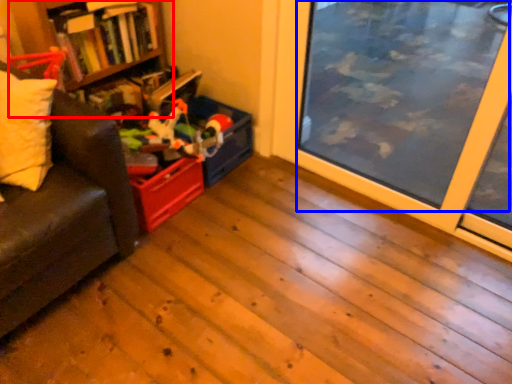
Question: Which object is further to the camera taking this photo, bookshelf (highlighted by a red box) or window screen (highlighted by a blue box)?

Choices:
 (A) bookshelf
 (B) window screen

Answer: (A)